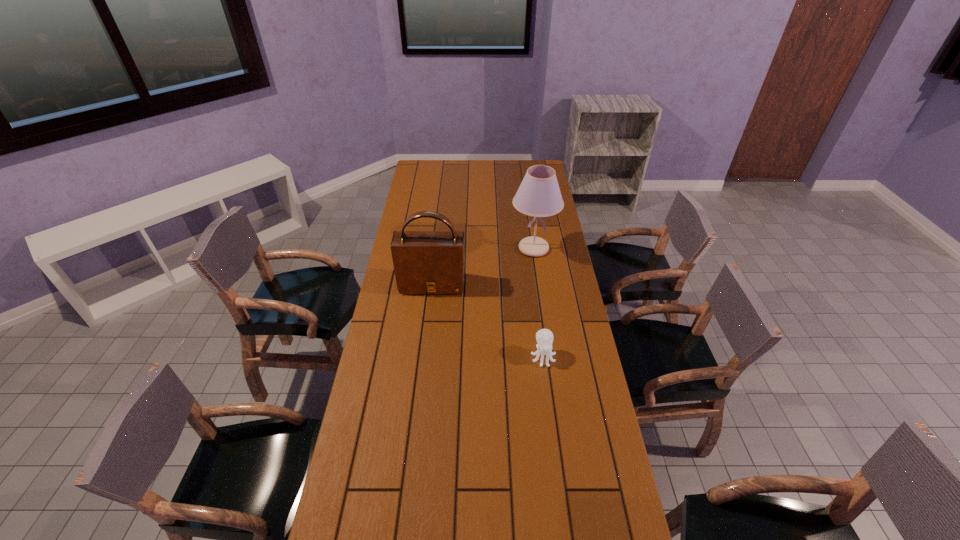
Identify the location of the farthest object. (539, 195).

What are the coordinates of `shoulder bag` in the screenshot? It's located at (425, 262).

Locate an element on the screen. the leftmost object is located at coordinates (425, 262).

Locate an element on the screen. This screenshot has width=960, height=540. the shortest object is located at coordinates (544, 337).

Where is `the nearest object`? The height and width of the screenshot is (540, 960). the nearest object is located at coordinates (544, 337).

Locate an element on the screen. free region located on the left of the farthest object is located at coordinates (444, 248).

At what (x,y) coordinates should I click in order to perform the action: click on free space located on the front flap of the leftmost object. Please return your answer as a coordinate pair (x, y). Looking at the image, I should click on (427, 322).

This screenshot has height=540, width=960. I want to click on vacant space located 0.180m on the front-facing side of the shortest object, so click(x=551, y=414).

Where is `object at the left edge`? object at the left edge is located at coordinates (425, 262).

What are the coordinates of `lampshade positioned at the right edge` in the screenshot? It's located at (539, 195).